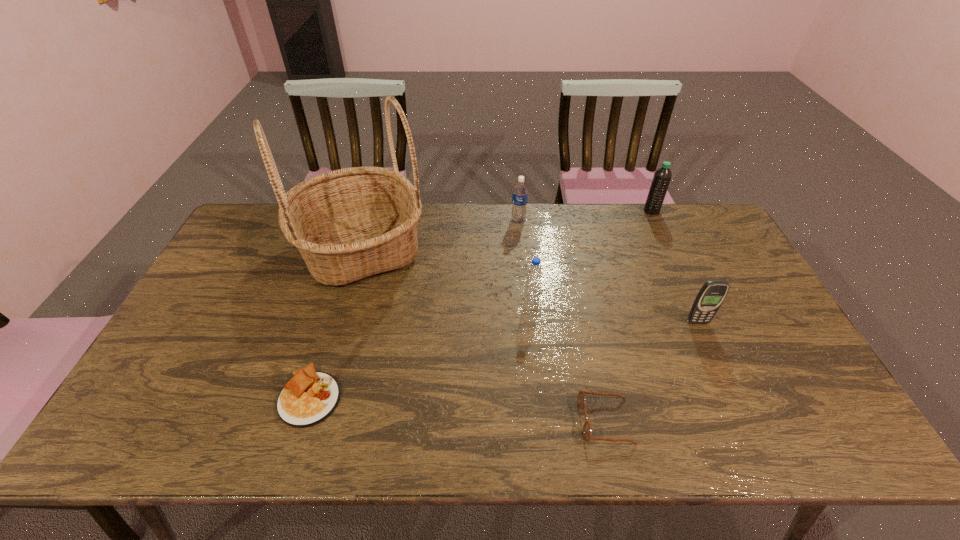
Where is `free space between the second nearest water bottle and the spectacles`? free space between the second nearest water bottle and the spectacles is located at coordinates (562, 320).

Image resolution: width=960 pixels, height=540 pixels. I want to click on free point between the rightmost water bottle and the shortest object, so click(481, 303).

Find the location of a particular element. The width and height of the screenshot is (960, 540). empty space that is in between the cellular telephone and the farthest water bottle is located at coordinates (675, 266).

Find the location of a particular element. The image size is (960, 540). vacant region between the sixth tallest object and the second farthest water bottle is located at coordinates (562, 320).

At what (x,y) coordinates should I click in order to perform the action: click on free space between the cellular telephone and the second shortest object. Please return your answer as a coordinate pair (x, y). Looking at the image, I should click on (652, 372).

Locate an element on the screen. This screenshot has width=960, height=540. blank region between the nearest water bottle and the shortest object is located at coordinates (421, 349).

Image resolution: width=960 pixels, height=540 pixels. I want to click on free spot between the third nearest object and the second shortest object, so [x=652, y=372].

I want to click on the fourth closest object relative to the second nearest water bottle, so [709, 299].

You are a GUI agent. You are given a task and a screenshot of the screen. Output one action in this format:
    pyautogui.click(x=<x>, y=<y>)
    Task: Click on the object that can be found as the fourth closest to the shortest object
    Image resolution: width=960 pixels, height=540 pixels.
    Given the screenshot: What is the action you would take?
    pyautogui.click(x=520, y=190)

Locate which water bottle is the third closest to the third object from right to left. Please provide its 2D coordinates. Your answer should be formatted as a tuple, i.e. [(x, y)], where the tuple contains the x and y coordinates of a point satisfying the conditions above.

[(662, 177)]